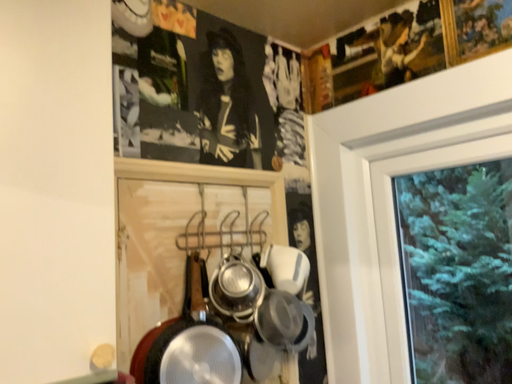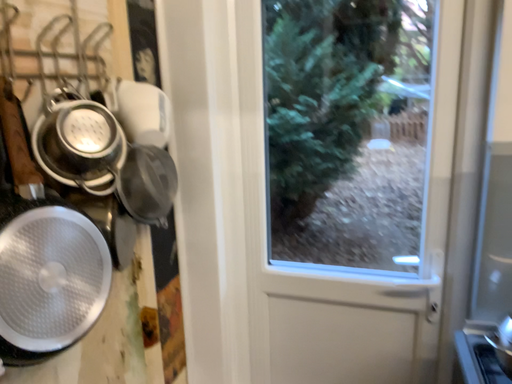
Question: How did the camera likely rotate when shooting the video?

Choices:
 (A) rotated left
 (B) rotated right

Answer: (B)